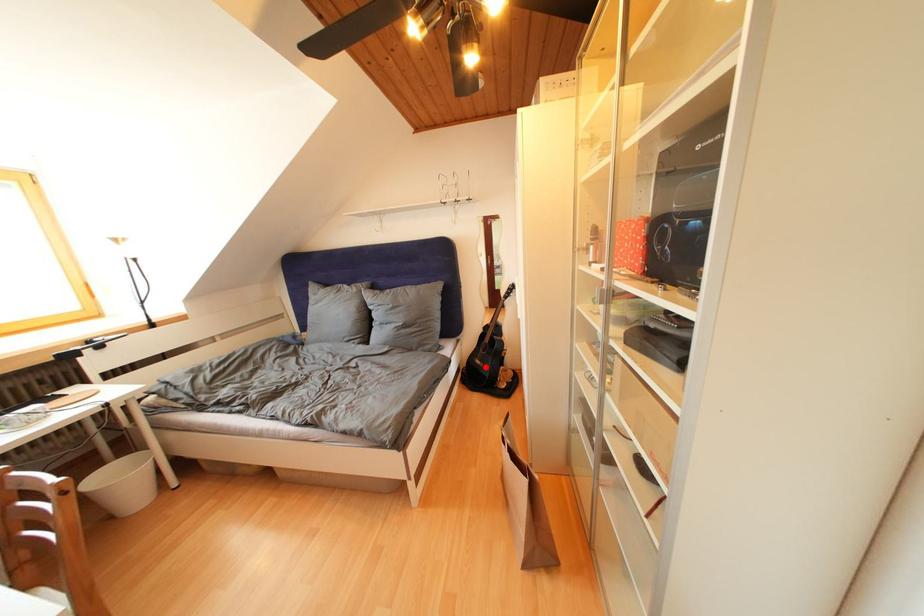
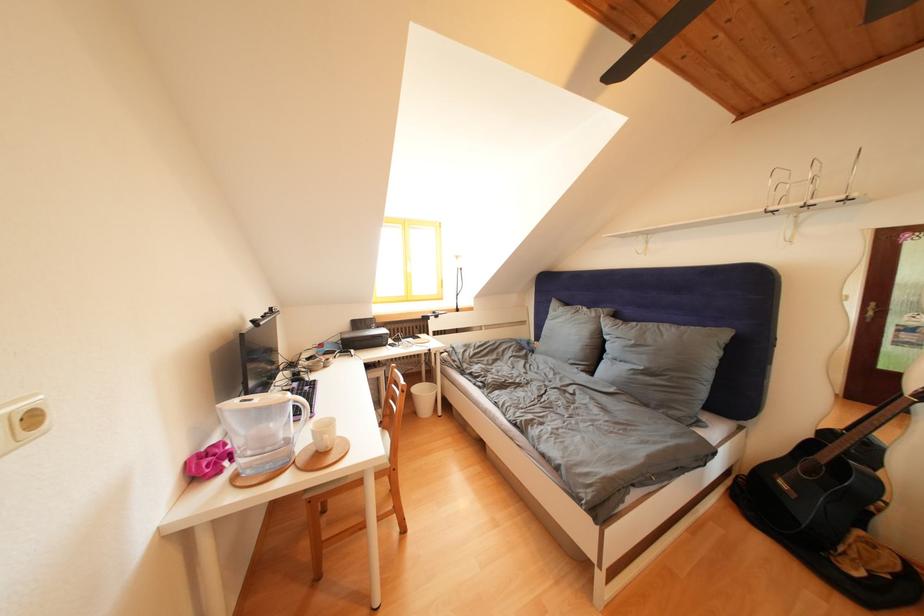
Find the pixel in the second image that matches the highlighted location in the first image.

(791, 488)